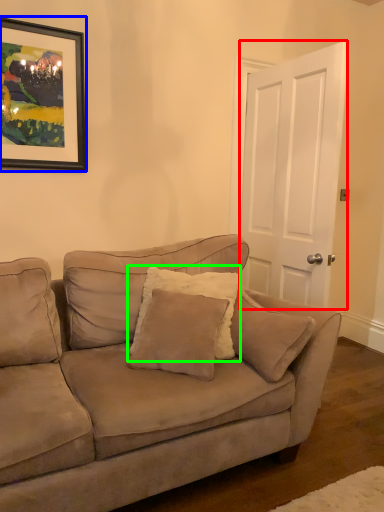
Question: Estimate the real-world distances between objects in this image. Which object is closer to door (highlighted by a red box), picture frame (highlighted by a blue box) or pillow (highlighted by a green box)?

Choices:
 (A) picture frame
 (B) pillow

Answer: (B)